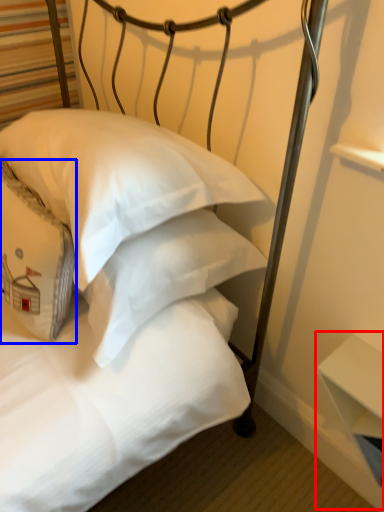
Question: Which point is closer to the camera, table (highlighted by a red box) or pillow (highlighted by a blue box)?

Choices:
 (A) table
 (B) pillow

Answer: (B)